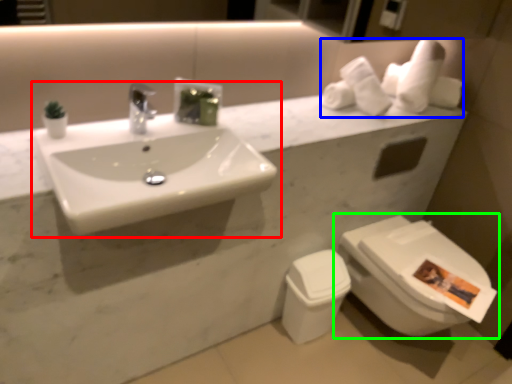
Question: Considering the real-world distances, which object is farthest from sink (highlighted by a red box)? toilet paper (highlighted by a blue box) or toilet (highlighted by a green box)?

Choices:
 (A) toilet paper
 (B) toilet

Answer: (B)